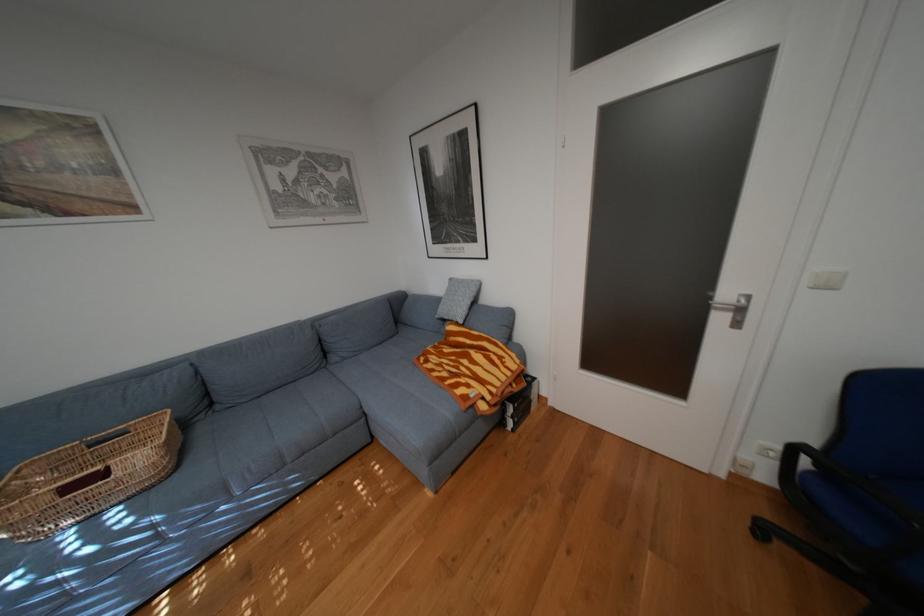
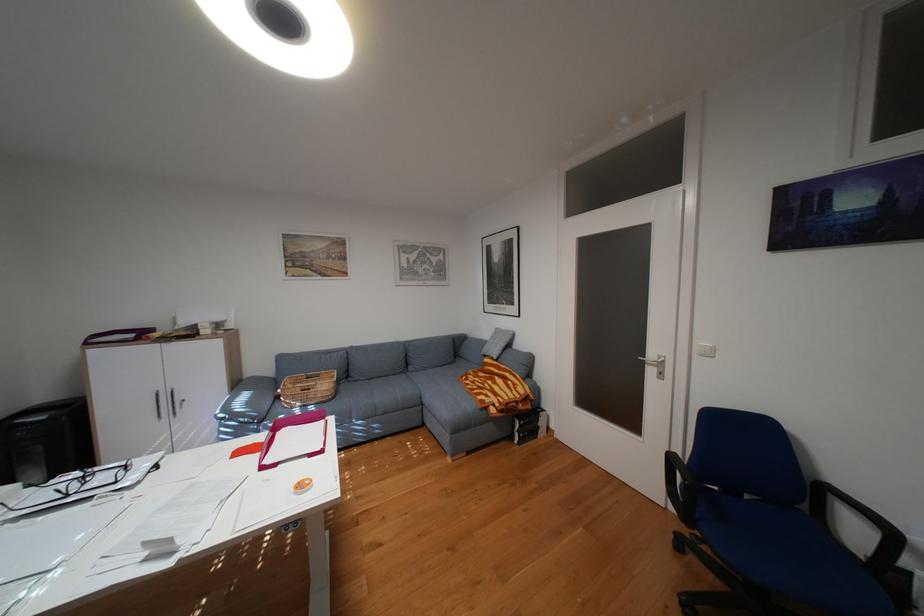
Where in the second image is the point corresponding to point (357, 358) from the first image?

(430, 370)